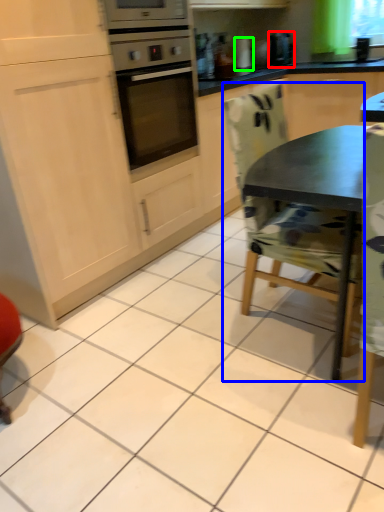
Question: Which object is the farthest from coffee machine (highlighted by a red box)? Choose among these: chair (highlighted by a blue box) or appliance (highlighted by a green box).

Choices:
 (A) chair
 (B) appliance

Answer: (A)